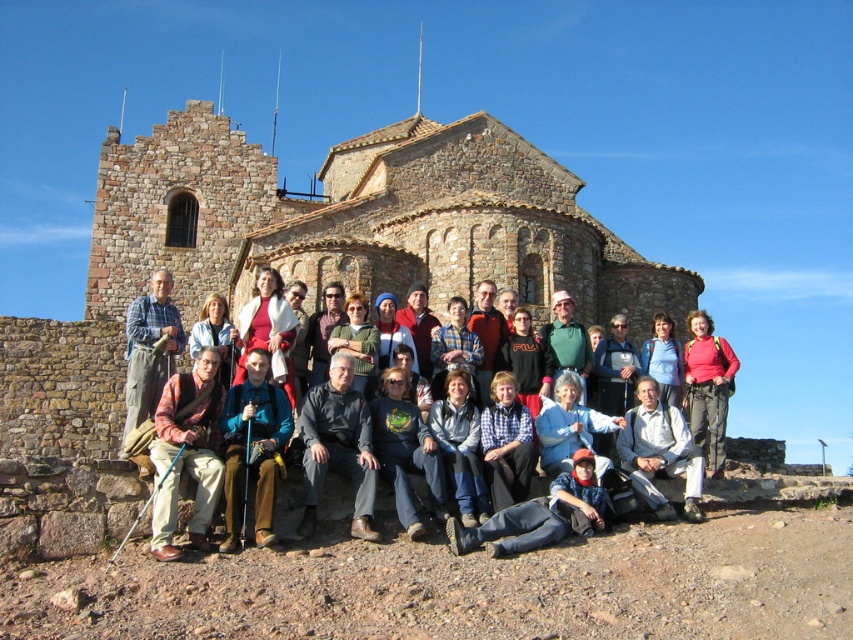
Question: Which object appears closest to the camera in this image?

Choices:
 (A) blue denim jacket at center
 (B) brown stone church at center

Answer: (A)

Question: Which of the following is the farthest from the observer?

Choices:
 (A) brown stone church at center
 (B) blue plaid shirt at center
 (C) matte red jacket at right
 (D) plaid fabric shirt at center

Answer: (A)

Question: Does plaid fabric shirt at center have a greater width compared to blue fabric backpack at center?

Choices:
 (A) no
 (B) yes

Answer: (B)

Question: Which point is farther to the camera?

Choices:
 (A) (165, 404)
 (B) (433, 221)
 (C) (137, 355)
 (D) (268, 490)

Answer: (B)

Question: Is dark gray fabric jacket at center wider than blue fabric backpack at center?

Choices:
 (A) yes
 (B) no

Answer: (B)

Question: Can you confirm if dark gray fabric jacket at center is smaller than blue fabric backpack at center?

Choices:
 (A) yes
 (B) no

Answer: (A)